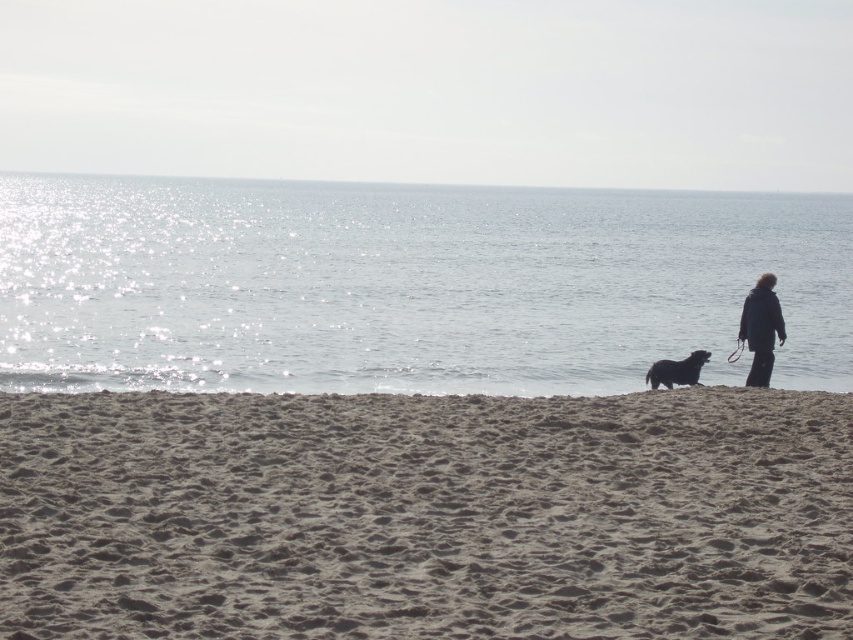
Based on the photo, between brown sandy beach at lower center and dark blue jacket at right, which one has more height?

With more height is dark blue jacket at right.

Which is in front, point (259, 577) or point (770, 328)?

Point (259, 577) is in front.

The image size is (853, 640). I want to click on brown sandy beach at lower center, so click(x=426, y=515).

From the picture: Is brown sandy beach at lower center closer to the viewer compared to sparkling water at center?

Yes, it is in front of sparkling water at center.

Which is in front, point (833, 563) or point (117, 221)?

Point (833, 563) is in front.

Does point (244, 538) lie in front of point (469, 291)?

Yes.

Locate an element on the screen. Image resolution: width=853 pixels, height=640 pixels. brown sandy beach at lower center is located at coordinates (426, 515).

Is dark blue jacket at right thinner than dark brown fur dog at lower right?

Yes, dark blue jacket at right is thinner than dark brown fur dog at lower right.

Does dark blue jacket at right come behind dark brown fur dog at lower right?

No, dark blue jacket at right is in front of dark brown fur dog at lower right.

Describe the element at coordinates (761, 328) in the screenshot. I see `dark blue jacket at right` at that location.

Locate an element on the screen. This screenshot has width=853, height=640. dark blue jacket at right is located at coordinates 761,328.